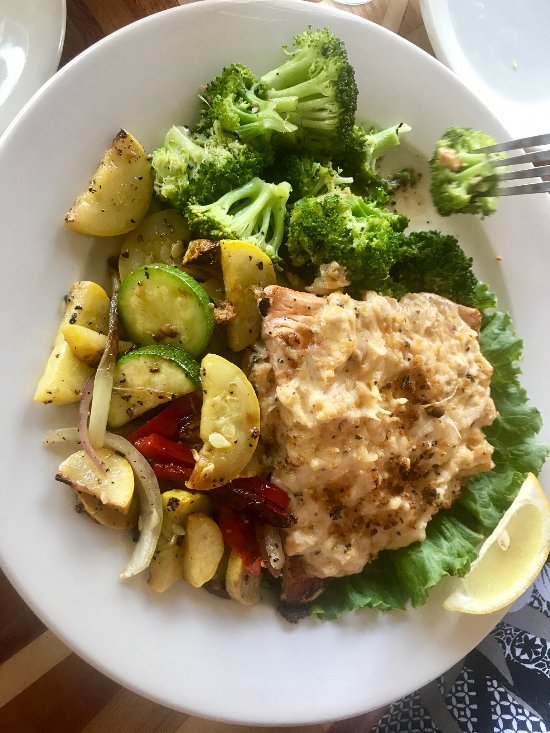
This screenshot has height=733, width=550. I want to click on white plate, so click(x=500, y=84).